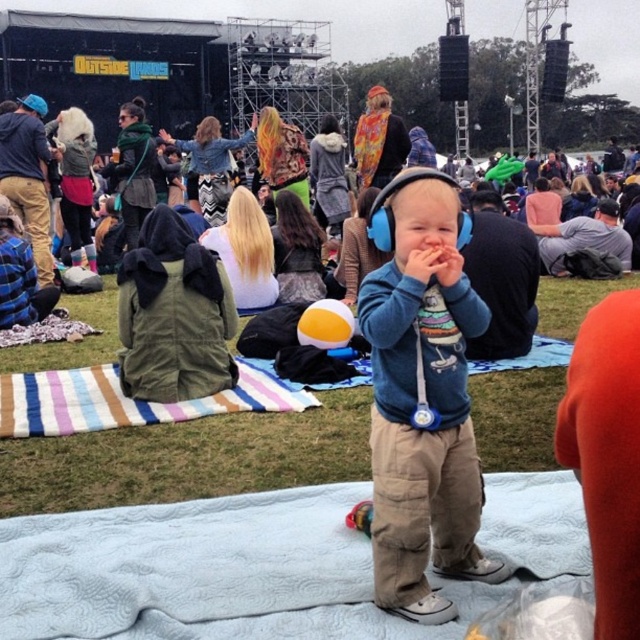
Question: Which point is closer to the camera?

Choices:
 (A) (412, 413)
 (B) (449, 634)

Answer: (B)

Question: Does blue quilted blanket at center appear on the left side of blue fabric headphones at center?

Choices:
 (A) no
 (B) yes

Answer: (B)

Question: Is blue quilted blanket at center positioned behind blue fabric headphones at center?

Choices:
 (A) no
 (B) yes

Answer: (A)

Question: Does blue quilted blanket at center lie in front of blue fabric headphones at center?

Choices:
 (A) yes
 (B) no

Answer: (A)